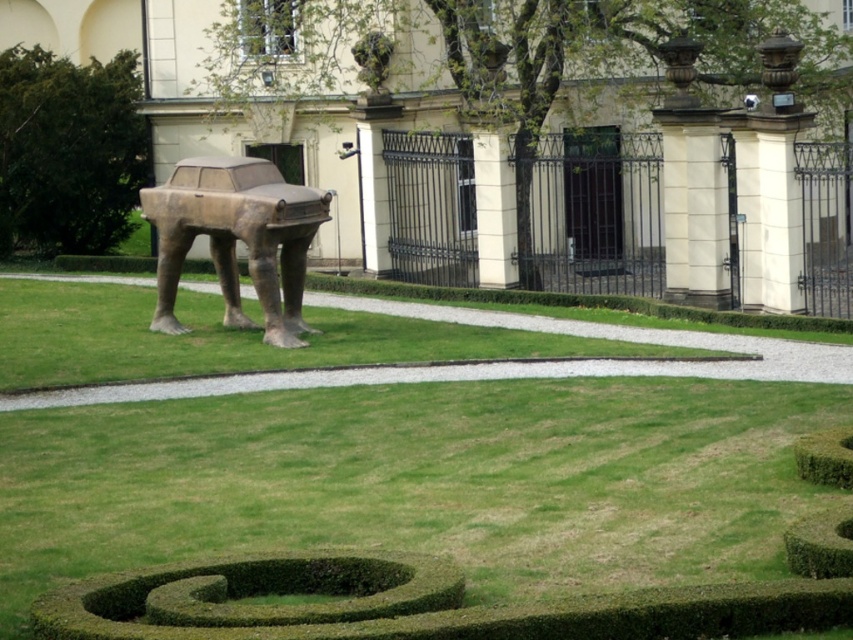
Based on the photo, you are standing at the entrance of the classical building and want to reach the green grass at center. Which direction should you walk to get there?

You should walk towards the lawn area located in the center of the garden to reach the green grass at center.

You are a maintenance worker in the park and need to mow the green grass at center. Since the bronze statue at center is in the way, can you mow the grass below it?

The green grass at center is below bronze statue at center, so you can mow the grass below the bronze statue at center.